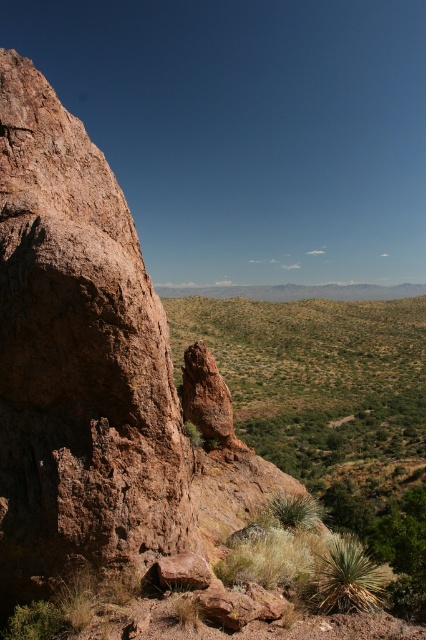
You are a desert explorer standing at the edge of the desert. You see the brown rough rock at left and the green leafy shrubs at center. Which object is closer to the ground?

The brown rough rock at left is located below the green leafy shrubs at center, so it is closer to the ground.

You are standing in the desert scene and want to reach both the point at coordinates point (129, 372) and the point at coordinates point (419, 580). Which point should you head towards first if you want to reach the one closer to you first?

You should head towards point (129, 372) first because it is closer to you than point (419, 580).

You are a hiker who needs to cross the desert. You have a water bottle that can hold 1 liter of water. The recommended water consumption is 0.5 liters per kilometer. Can you safely walk from the brown rough rock at left to the green leafy shrubs at center without needing more water?

The distance between the brown rough rock at left and the green leafy shrubs at center is 56.96 meters, which is approximately 0.05696 kilometers. Since the recommended water consumption is 0.5 liters per kilometer, the total required water would be 0.05696 km multiplied by 0.5 L per km, totaling about 0.02848 liters. This is well within the capacity of a 1 liter water bottle, so yes, you can safely walk from the brown rough rock at left to the green leafy shrubs at center without needing more water.